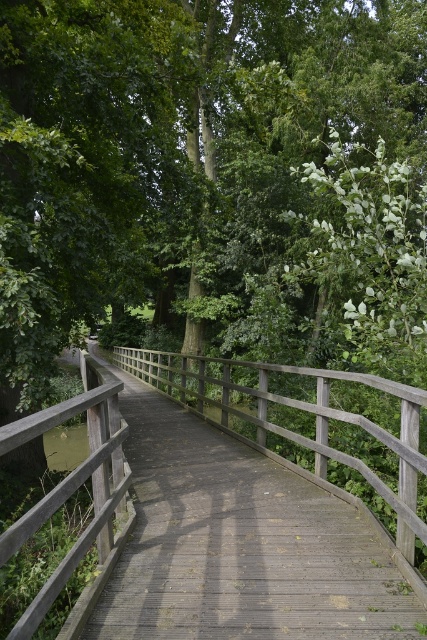
You are a hiker carrying a 5 meter long wooden beam. You want to place it horizontally across the wooden bridge at center and the wooden rail at left. Can the beam fit between them?

The distance between the wooden bridge at center and the wooden rail at left is 4.75 meters. Since the beam is 5 meters long, it cannot fit between them as the beam is longer than the available space.

You are standing on the wooden bridge and want to walk towards the point labeled point (253, 576). Which direction should you move relative to the point labeled point (20, 426)?

You should move towards the point labeled point (253, 576), which is closer to you than the point labeled point (20, 426). Since point (253, 576) is further to the viewer, it is nearer, so walk toward it away from point (20, 426).